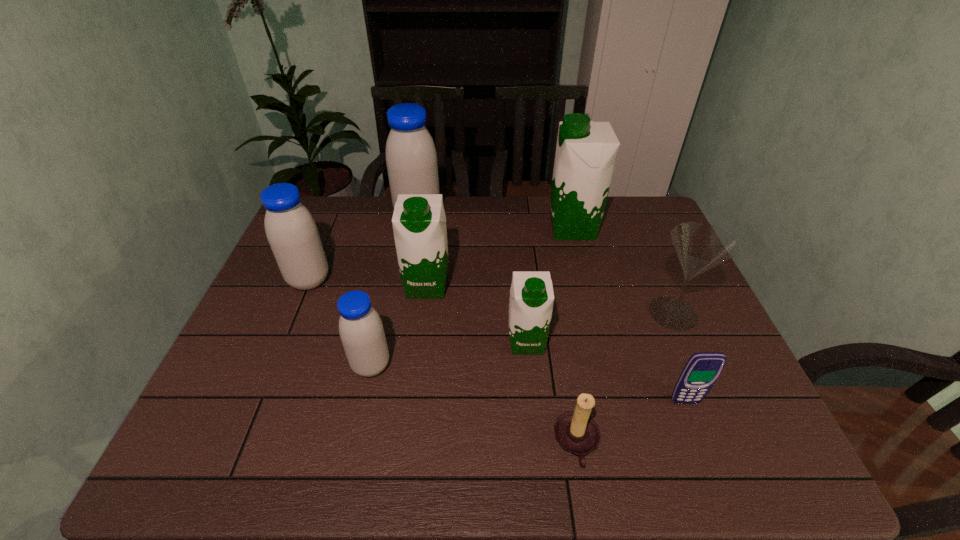
Identify which green soya milk is located as the second nearest to the second smallest green soya milk. Please provide its 2D coordinates. Your answer should be formatted as a tuple, i.e. [(x, y)], where the tuple contains the x and y coordinates of a point satisfying the conditions above.

[(586, 151)]

Locate an element on the screen. This screenshot has height=540, width=960. green soya milk that can be found as the third closest to the eighth farthest object is located at coordinates (419, 221).

The image size is (960, 540). Identify the location of blue soya milk that can be found as the second closest to the farthest blue soya milk. (361, 330).

Where is `blue soya milk that is the third closest to the second biggest green soya milk`? blue soya milk that is the third closest to the second biggest green soya milk is located at coordinates (291, 231).

I want to click on vacant point that satisfies the following two spatial constraints: 1. on the front-facing side of the rightmost green soya milk; 2. on the right side of the flute glass, so click(594, 313).